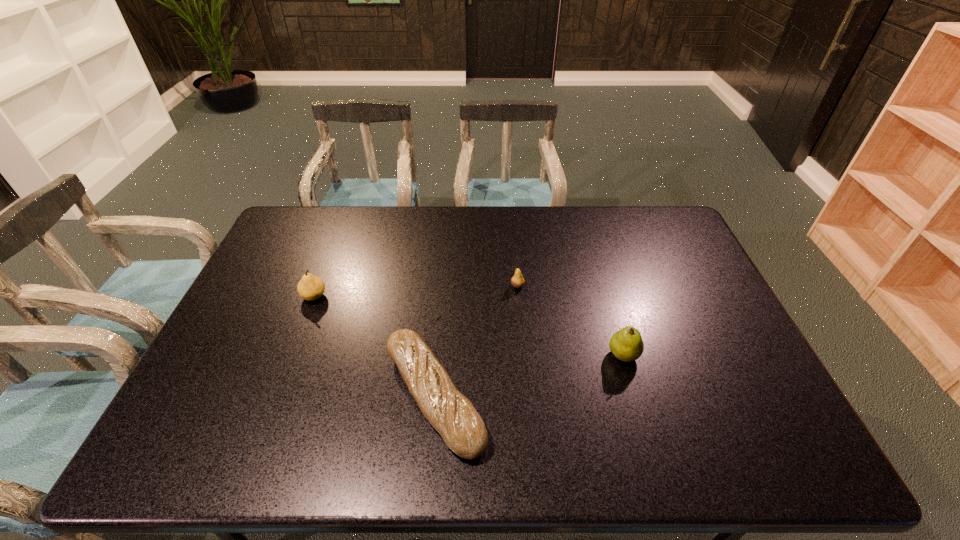
You are a GUI agent. You are given a task and a screenshot of the screen. Output one action in this format:
    pyautogui.click(x=<x>, y=<y>)
    Task: Click on the object positioned at the near edge
    Image resolution: width=960 pixels, height=540 pixels.
    Given the screenshot: What is the action you would take?
    pyautogui.click(x=453, y=415)

This screenshot has width=960, height=540. I want to click on vacant area at the far edge of the desktop, so click(496, 236).

What are the coordinates of `vacant space at the near edge of the desktop` in the screenshot? It's located at (549, 433).

This screenshot has width=960, height=540. In the image, there is a desktop. What are the coordinates of `free region at the left edge` in the screenshot? It's located at (209, 399).

Find the location of a particular element. Image resolution: width=960 pixels, height=540 pixels. empty space that is in between the nearest pear and the baguet is located at coordinates (529, 375).

Find the location of a particular element. The width and height of the screenshot is (960, 540). empty location between the leftmost object and the shortest pear is located at coordinates (416, 291).

The image size is (960, 540). I want to click on free area in between the baguet and the leftmost pear, so click(x=374, y=346).

At what (x,y) coordinates should I click in order to perform the action: click on unoccupied position between the baguet and the rightmost pear. Please return your answer as a coordinate pair (x, y). Looking at the image, I should click on (529, 375).

This screenshot has height=540, width=960. Identify the location of empty space that is in between the third object from left to right and the leftmost object. (416, 291).

Identify the location of free point between the leftmost pear and the second pear from right to left. (416, 291).